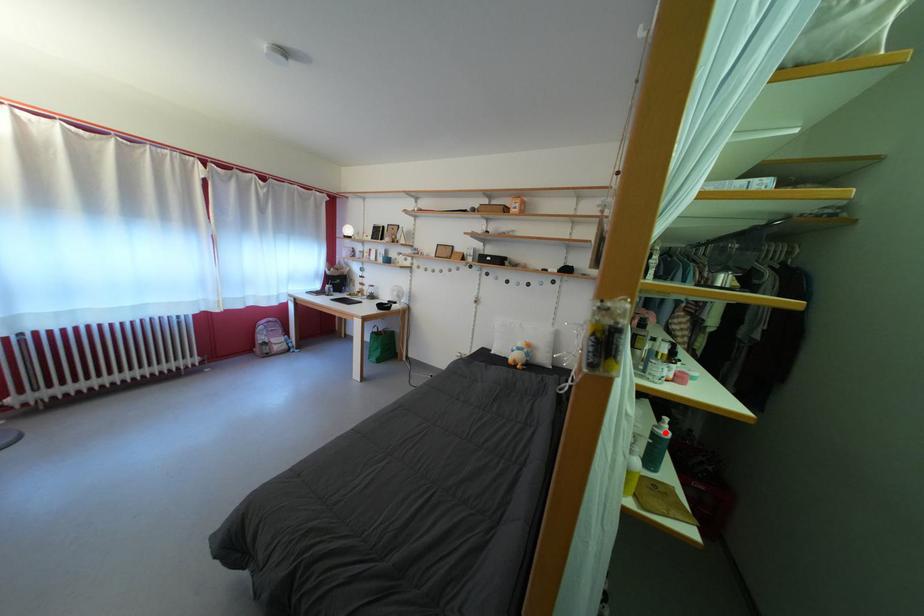
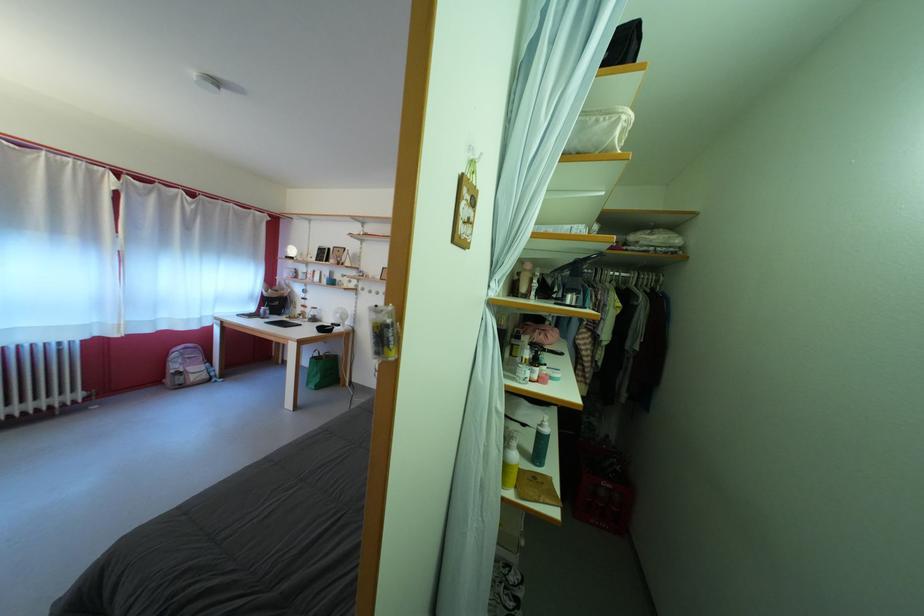
Question: A red point is marked in image1. In image2, is the corresponding 3D point closer to the camera or farther? Reply with the corresponding letter.

Choices:
 (A) The corresponding 3D point is closer.
 (B) The corresponding 3D point is farther.

Answer: (B)